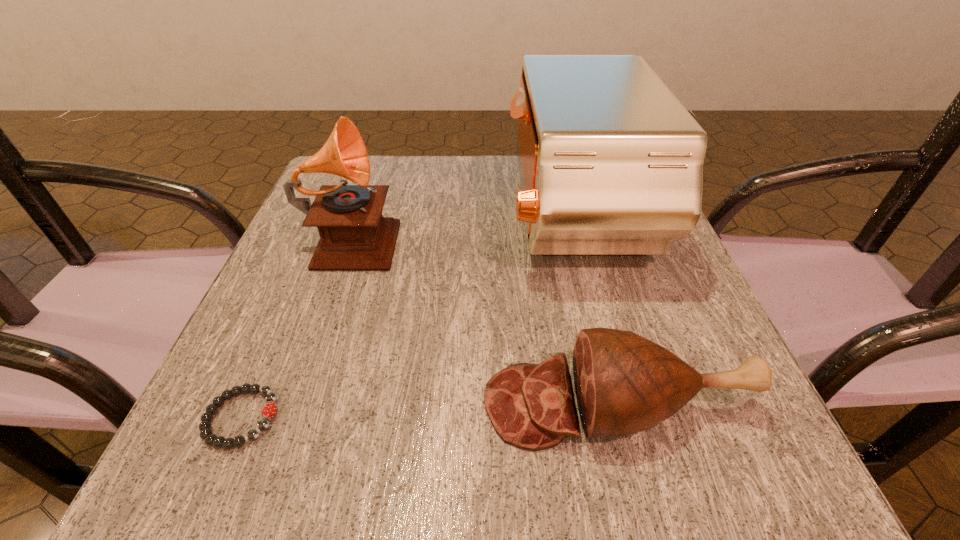
Image resolution: width=960 pixels, height=540 pixels. Identify the location of toaster oven. (611, 163).

In order to click on phonograph record in this screenshot , I will do `click(354, 236)`.

At what (x,y) coordinates should I click in order to perform the action: click on the second shortest object. Please return your answer as a coordinate pair (x, y). Looking at the image, I should click on (624, 383).

Find the location of a particular element. Image resolution: width=960 pixels, height=540 pixels. bracelet is located at coordinates (269, 410).

You are a GUI agent. You are given a task and a screenshot of the screen. Output one action in this format:
    pyautogui.click(x=<x>, y=<y>)
    Task: Click on the vacant space located 0.150m on the door side of the toaster oven
    The width and height of the screenshot is (960, 540).
    Given the screenshot: What is the action you would take?
    pyautogui.click(x=435, y=216)

Locate an element on the screen. The height and width of the screenshot is (540, 960). vacant region located on the door side of the toaster oven is located at coordinates (317, 216).

I want to click on free region located 0.250m on the door side of the toaster oven, so pyautogui.click(x=388, y=216).

Locate an element on the screen. free space located 0.370m on the horn of the phonograph record is located at coordinates pos(583,237).

The image size is (960, 540). I want to click on vacant space located at the sliced end of the third tallest object, so click(x=433, y=404).

Identify the location of free region located 0.260m at the sliced end of the third tallest object. (295, 404).